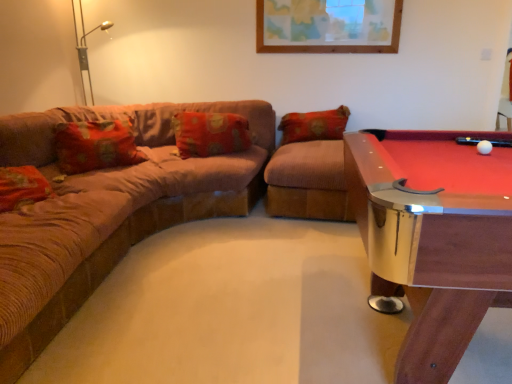
Question: Is brown corduroy couch at left taller than floral fabric pillow at center?

Choices:
 (A) no
 (B) yes

Answer: (B)

Question: Is brown corduroy couch at left completely or partially outside of floral fabric pillow at center?

Choices:
 (A) yes
 (B) no

Answer: (A)

Question: Could you tell me if brown corduroy couch at left is turned towards floral fabric pillow at center?

Choices:
 (A) no
 (B) yes

Answer: (B)

Question: Does brown corduroy couch at left appear on the left side of floral fabric pillow at center?

Choices:
 (A) no
 (B) yes

Answer: (B)

Question: Is floral fabric pillow at center surrounded by brown corduroy couch at left?

Choices:
 (A) yes
 (B) no

Answer: (A)

Question: From a real-world perspective, does brown corduroy couch at left sit lower than floral fabric pillow at center?

Choices:
 (A) yes
 (B) no

Answer: (A)

Question: Is floral fabric pillow at center in front of wooden pool table at right?

Choices:
 (A) no
 (B) yes

Answer: (A)

Question: Does floral fabric pillow at center appear on the left side of wooden pool table at right?

Choices:
 (A) yes
 (B) no

Answer: (A)

Question: Considering the relative sizes of floral fabric pillow at center and wooden pool table at right in the image provided, is floral fabric pillow at center shorter than wooden pool table at right?

Choices:
 (A) no
 (B) yes

Answer: (B)

Question: From a real-world perspective, is floral fabric pillow at center physically above wooden pool table at right?

Choices:
 (A) no
 (B) yes

Answer: (B)

Question: Does floral fabric pillow at center come behind wooden pool table at right?

Choices:
 (A) yes
 (B) no

Answer: (A)

Question: From the image's perspective, is floral fabric pillow at center over wooden pool table at right?

Choices:
 (A) yes
 (B) no

Answer: (A)

Question: Does wooden pool table at right appear on the right side of floral fabric pillow at center?

Choices:
 (A) no
 (B) yes

Answer: (B)